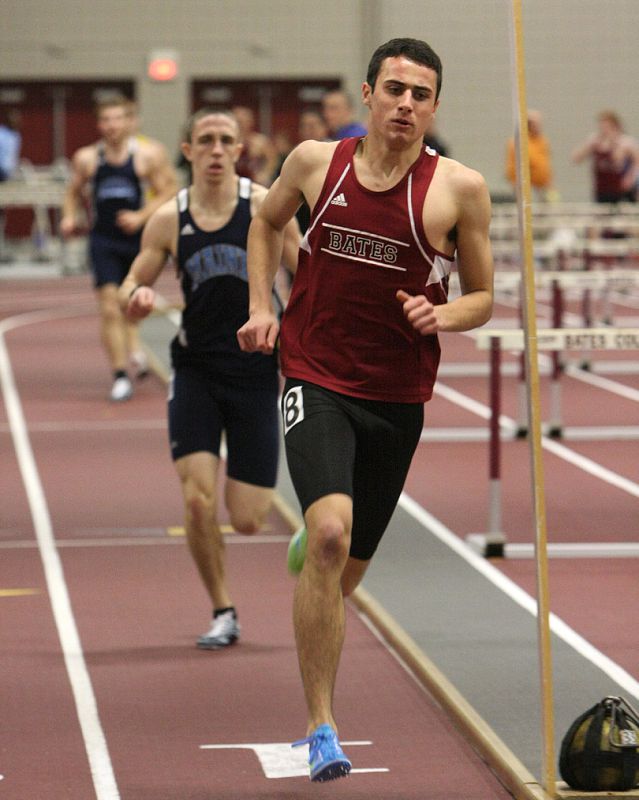
Locate an element on the screen. door is located at coordinates (85, 113).